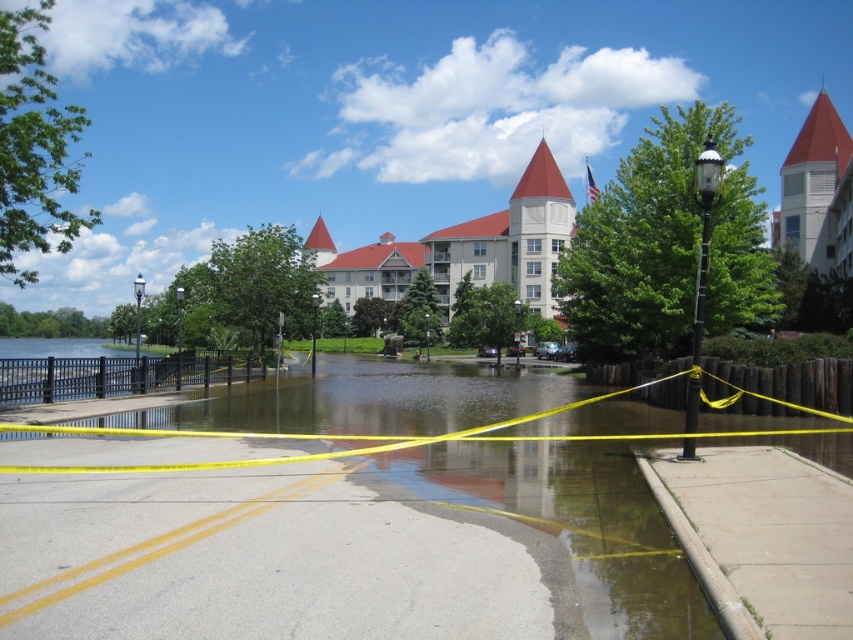
Is gray concrete pavement at lower center thinner than beige stone hotel at center?

Yes, gray concrete pavement at lower center is thinner than beige stone hotel at center.

Does point (308, 483) come in front of point (315, 230)?

Yes, point (308, 483) is in front of point (315, 230).

Where is `gray concrete pavement at lower center`? gray concrete pavement at lower center is located at coordinates (251, 560).

Where is `gray concrete pavement at lower center`? This screenshot has height=640, width=853. gray concrete pavement at lower center is located at coordinates (251, 560).

Does gray concrete pavement at lower center have a smaller size compared to gray concrete sidewalk at lower right?

Yes.

Where is `gray concrete pavement at lower center`? gray concrete pavement at lower center is located at coordinates (251, 560).

I want to click on gray concrete pavement at lower center, so click(251, 560).

Does beige stone hotel at center appear on the left side of matte red tower at upper right?

Correct, you'll find beige stone hotel at center to the left of matte red tower at upper right.

Can you confirm if beige stone hotel at center is thinner than matte red tower at upper right?

Incorrect, beige stone hotel at center's width is not less than matte red tower at upper right's.

The height and width of the screenshot is (640, 853). I want to click on beige stone hotel at center, so click(463, 248).

In order to click on beige stone hotel at center in this screenshot , I will do `click(463, 248)`.